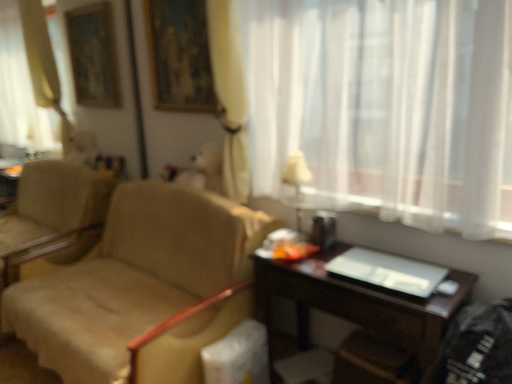
Question: Could you tell me if white fabric lampshade at upper center is facing white sheer curtain at upper right?

Choices:
 (A) yes
 (B) no

Answer: (A)

Question: From the image's perspective, is white fabric lampshade at upper center under white sheer curtain at upper right?

Choices:
 (A) no
 (B) yes

Answer: (B)

Question: Is white fabric lampshade at upper center positioned behind white sheer curtain at upper right?

Choices:
 (A) no
 (B) yes

Answer: (B)

Question: Does white fabric lampshade at upper center have a greater width compared to white sheer curtain at upper right?

Choices:
 (A) yes
 (B) no

Answer: (B)

Question: Is white fabric lampshade at upper center taller than white sheer curtain at upper right?

Choices:
 (A) yes
 (B) no

Answer: (B)

Question: Can you confirm if white fabric lampshade at upper center is positioned to the left of white sheer curtain at upper right?

Choices:
 (A) no
 (B) yes

Answer: (B)

Question: Is white fabric lampshade at upper center wider than beige fabric chair at left?

Choices:
 (A) no
 (B) yes

Answer: (A)

Question: Does white fabric lampshade at upper center lie behind beige fabric chair at left?

Choices:
 (A) yes
 (B) no

Answer: (A)

Question: Is beige fabric chair at left located within white fabric lampshade at upper center?

Choices:
 (A) no
 (B) yes

Answer: (A)

Question: Does white fabric lampshade at upper center have a smaller size compared to beige fabric chair at left?

Choices:
 (A) no
 (B) yes

Answer: (B)

Question: Is the position of white fabric lampshade at upper center less distant than that of beige fabric chair at left?

Choices:
 (A) no
 (B) yes

Answer: (A)

Question: Is white fabric lampshade at upper center shorter than beige fabric chair at left?

Choices:
 (A) yes
 (B) no

Answer: (A)

Question: Does wooden picture frame at upper center lie behind beige fabric chair at left?

Choices:
 (A) yes
 (B) no

Answer: (A)